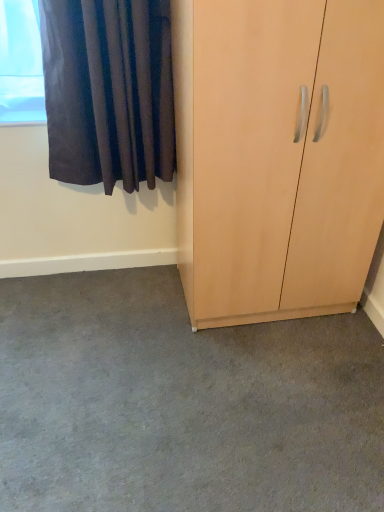
Identify the location of vacant space in dark velvet curtain at upper left (from a real-world perspective). (121, 273).